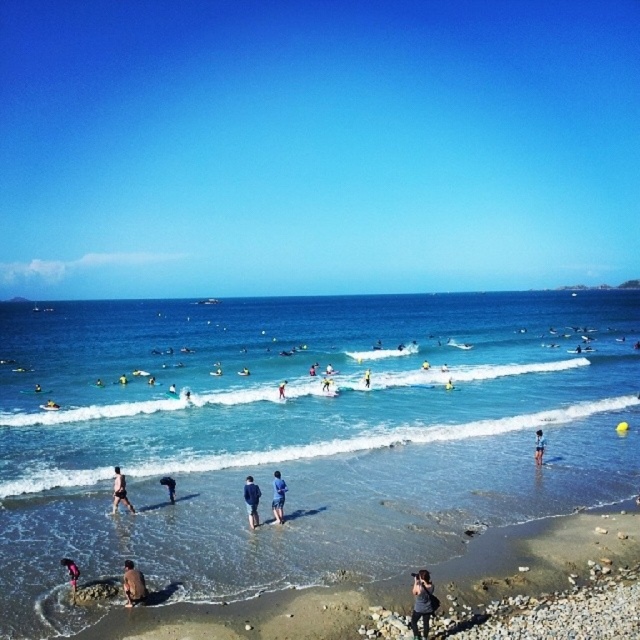
You are standing at the bottom left corner of the image. You want to walk to the brown sandy beach at lower center. Which direction should you move?

You should move towards the right and slightly upwards to reach the brown sandy beach at lower center located at point (257, 616).

You are a photographer trying to capture a photo of the pink fabric person at lower left and the dark blue fabric shorts at lower left. Based on their positions, which object should you focus on first to ensure both are in the frame?

The pink fabric person at lower left is located below the dark blue fabric shorts at lower left, so you should focus on the dark blue fabric shorts at lower left first to ensure both are in the frame.